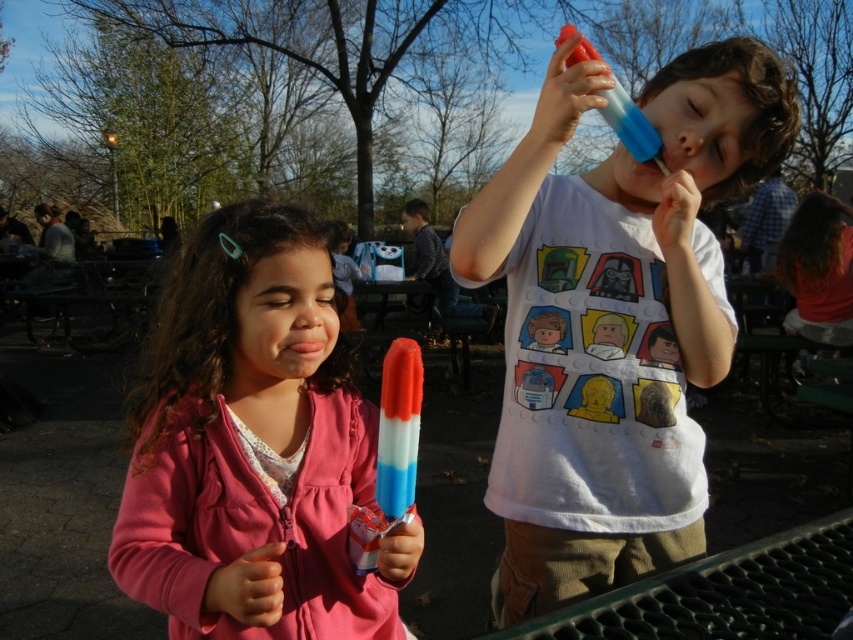
Is point (685, 138) more distant than point (316, 362)?

Yes.

Who is shorter, smooth skin nose at center or matte pink lips at center?

With less height is matte pink lips at center.

Does point (697, 145) lie in front of point (286, 342)?

No, it is not.

The height and width of the screenshot is (640, 853). Find the location of `smooth skin nose at center`. smooth skin nose at center is located at coordinates (688, 141).

Does white cotton shirt at center have a greater height compared to matte pink lips at center?

Indeed, white cotton shirt at center has a greater height compared to matte pink lips at center.

Is white cotton shirt at center closer to the viewer compared to matte pink lips at center?

No.

Does point (590, 80) come closer to viewer compared to point (328, 348)?

That is False.

This screenshot has height=640, width=853. I want to click on white cotton shirt at center, so click(x=613, y=321).

Which is more to the left, matte pink jacket at center or matte pink lips at center?

matte pink jacket at center is more to the left.

Is matte pink jacket at center taller than matte pink lips at center?

Indeed, matte pink jacket at center has a greater height compared to matte pink lips at center.

Measure the distance between matte pink jacket at center and camera.

matte pink jacket at center is 29.34 inches away from camera.

Where is `matte pink jacket at center`? The width and height of the screenshot is (853, 640). matte pink jacket at center is located at coordinates (253, 448).